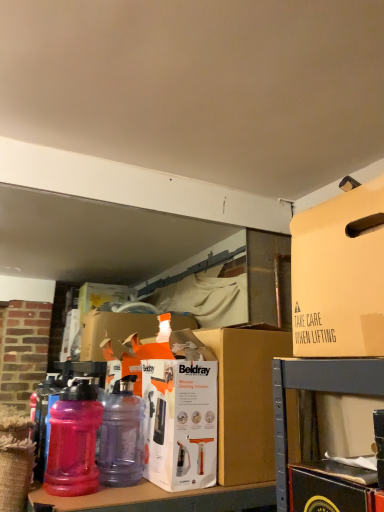
What do you see at coordinates (121, 436) in the screenshot? I see `translucent purple bottle at center, which ranks as the 2th bottle in left-to-right order` at bounding box center [121, 436].

Image resolution: width=384 pixels, height=512 pixels. In order to click on beige cardboard box at upper right in this screenshot , I will do (339, 275).

The width and height of the screenshot is (384, 512). What are the coordinates of `pink translucent water bottle at lower left, the 1th bottle in the left-to-right sequence` in the screenshot? It's located at (74, 440).

Considering the relative sizes of beige cardboard box at upper right and pink translucent water bottle at lower left, the 1th bottle in the left-to-right sequence, in the image provided, is beige cardboard box at upper right smaller than pink translucent water bottle at lower left, the 1th bottle in the left-to-right sequence,?

No, beige cardboard box at upper right is not smaller than pink translucent water bottle at lower left, the 1th bottle in the left-to-right sequence.

Is beige cardboard box at upper right beside pink translucent water bottle at lower left, the 2th bottle viewed from the right?

They are not placed beside each other.

Locate an element on the screen. The height and width of the screenshot is (512, 384). bottle that is in front of the translucent purple bottle at center, which ranks as the 2th bottle in left-to-right order is located at coordinates (74, 440).

Can pink translucent water bottle at lower left, the 2th bottle viewed from the right, be found inside translucent purple bottle at center, which ranks as the 2th bottle in left-to-right order?

No, pink translucent water bottle at lower left, the 2th bottle viewed from the right, is located outside of translucent purple bottle at center, which ranks as the 2th bottle in left-to-right order.

Would you say translucent purple bottle at center, which ranks as the 2th bottle in left-to-right order, is a long distance from pink translucent water bottle at lower left, the 2th bottle viewed from the right?

translucent purple bottle at center, which ranks as the 2th bottle in left-to-right order, is near pink translucent water bottle at lower left, the 2th bottle viewed from the right, not far away.

Is translucent purple bottle at center, which ranks as the 2th bottle in left-to-right order, at the right side of pink translucent water bottle at lower left, the 2th bottle viewed from the right?

Indeed, translucent purple bottle at center, which ranks as the 2th bottle in left-to-right order, is positioned on the right side of pink translucent water bottle at lower left, the 2th bottle viewed from the right.

From the image's perspective, is translucent purple bottle at center, which is counted as the 1th bottle, starting from the right, located beneath beige cardboard box at upper right?

Yes, from the image's perspective, translucent purple bottle at center, which is counted as the 1th bottle, starting from the right, is below beige cardboard box at upper right.

Is translucent purple bottle at center, which ranks as the 2th bottle in left-to-right order, to the right of beige cardboard box at upper right from the viewer's perspective?

In fact, translucent purple bottle at center, which ranks as the 2th bottle in left-to-right order, is to the left of beige cardboard box at upper right.

In the scene shown: Who is taller, translucent purple bottle at center, which is counted as the 1th bottle, starting from the right, or beige cardboard box at upper right?

translucent purple bottle at center, which is counted as the 1th bottle, starting from the right, is taller.

How much distance is there between translucent purple bottle at center, which ranks as the 2th bottle in left-to-right order, and brown cardboard box at center?

translucent purple bottle at center, which ranks as the 2th bottle in left-to-right order, is 31.29 centimeters away from brown cardboard box at center.

From a real-world perspective, is translucent purple bottle at center, which is counted as the 1th bottle, starting from the right, positioned under brown cardboard box at center based on gravity?

Correct, in the physical world, translucent purple bottle at center, which is counted as the 1th bottle, starting from the right, is lower than brown cardboard box at center.

Which is in front, point (114, 449) or point (226, 398)?

The point (114, 449) is in front.

Does translucent purple bottle at center, which ranks as the 2th bottle in left-to-right order, have a larger size compared to brown cardboard box at center?

→ Actually, translucent purple bottle at center, which ranks as the 2th bottle in left-to-right order, might be smaller than brown cardboard box at center.

Identify the location of bottle that is the 2nd object located below the brown cardboard box at center (from the image's perspective). (121, 436).

Does brown cardboard box at center turn towards translucent purple bottle at center, which ranks as the 2th bottle in left-to-right order?

No, brown cardboard box at center is not facing towards translucent purple bottle at center, which ranks as the 2th bottle in left-to-right order.

In the scene shown: What's the angular difference between brown cardboard box at center and translucent purple bottle at center, which ranks as the 2th bottle in left-to-right order,'s facing directions?

The facing directions of brown cardboard box at center and translucent purple bottle at center, which ranks as the 2th bottle in left-to-right order, are 0.601 degrees apart.

Measure the distance from brown cardboard box at center to translucent purple bottle at center, which ranks as the 2th bottle in left-to-right order.

brown cardboard box at center is 12.32 inches away from translucent purple bottle at center, which ranks as the 2th bottle in left-to-right order.

Does brown cardboard box at center lie behind beige cardboard box at upper right?

That is True.

Is point (264, 480) closer or farther from the camera than point (347, 233)?

Point (264, 480) is farther from the camera than point (347, 233).

Considering the relative sizes of brown cardboard box at center and beige cardboard box at upper right in the image provided, is brown cardboard box at center taller than beige cardboard box at upper right?

Yes.

From a real-world perspective, is brown cardboard box at center above or below beige cardboard box at upper right?

brown cardboard box at center is situated lower than beige cardboard box at upper right in the real world.

Is pink translucent water bottle at lower left, the 1th bottle in the left-to-right sequence, spatially inside translucent purple bottle at center, which is counted as the 1th bottle, starting from the right, or outside of it?

The correct answer is: outside.

From the image's perspective, would you say pink translucent water bottle at lower left, the 1th bottle in the left-to-right sequence, is shown under translucent purple bottle at center, which is counted as the 1th bottle, starting from the right?

Actually, pink translucent water bottle at lower left, the 1th bottle in the left-to-right sequence, appears above translucent purple bottle at center, which is counted as the 1th bottle, starting from the right, in the image.

Looking at this image, who is smaller, pink translucent water bottle at lower left, the 2th bottle viewed from the right, or translucent purple bottle at center, which ranks as the 2th bottle in left-to-right order?

translucent purple bottle at center, which ranks as the 2th bottle in left-to-right order, is smaller.

The image size is (384, 512). I want to click on bottle located underneath the pink translucent water bottle at lower left, the 2th bottle viewed from the right (from a real-world perspective), so click(121, 436).

Where is `bottle that is the 1st object located behind the beige cardboard box at upper right`? bottle that is the 1st object located behind the beige cardboard box at upper right is located at coordinates (74, 440).

I want to click on bottle directly beneath the pink translucent water bottle at lower left, the 1th bottle in the left-to-right sequence (from a real-world perspective), so click(x=121, y=436).

Based on their spatial positions, is translucent purple bottle at center, which is counted as the 1th bottle, starting from the right, or brown cardboard box at center further from pink translucent water bottle at lower left, the 2th bottle viewed from the right?

Among the two, brown cardboard box at center is located further to pink translucent water bottle at lower left, the 2th bottle viewed from the right.

When comparing their distances from pink translucent water bottle at lower left, the 1th bottle in the left-to-right sequence, does brown cardboard box at center or beige cardboard box at upper right seem closer?

brown cardboard box at center lies closer to pink translucent water bottle at lower left, the 1th bottle in the left-to-right sequence, than the other object.

Considering their positions, is beige cardboard box at upper right positioned further to pink translucent water bottle at lower left, the 1th bottle in the left-to-right sequence, than translucent purple bottle at center, which ranks as the 2th bottle in left-to-right order?

beige cardboard box at upper right is further to pink translucent water bottle at lower left, the 1th bottle in the left-to-right sequence.

Looking at this image, estimate the real-world distances between objects in this image. Which object is further from beige cardboard box at upper right, translucent purple bottle at center, which is counted as the 1th bottle, starting from the right, or pink translucent water bottle at lower left, the 1th bottle in the left-to-right sequence?

pink translucent water bottle at lower left, the 1th bottle in the left-to-right sequence, lies further to beige cardboard box at upper right than the other object.

Based on their spatial positions, is brown cardboard box at center or pink translucent water bottle at lower left, the 2th bottle viewed from the right, further from translucent purple bottle at center, which is counted as the 1th bottle, starting from the right?

Based on the image, brown cardboard box at center appears to be further to translucent purple bottle at center, which is counted as the 1th bottle, starting from the right.

When comparing their distances from translucent purple bottle at center, which is counted as the 1th bottle, starting from the right, does pink translucent water bottle at lower left, the 2th bottle viewed from the right, or brown cardboard box at center seem closer?

Based on the image, pink translucent water bottle at lower left, the 2th bottle viewed from the right, appears to be nearer to translucent purple bottle at center, which is counted as the 1th bottle, starting from the right.

Which object lies further to the anchor point pink translucent water bottle at lower left, the 2th bottle viewed from the right, brown cardboard box at center or translucent purple bottle at center, which ranks as the 2th bottle in left-to-right order?

The object further to pink translucent water bottle at lower left, the 2th bottle viewed from the right, is brown cardboard box at center.

Which object lies nearer to the anchor point beige cardboard box at upper right, brown cardboard box at center or translucent purple bottle at center, which ranks as the 2th bottle in left-to-right order?

Among the two, brown cardboard box at center is located nearer to beige cardboard box at upper right.

You are a GUI agent. You are given a task and a screenshot of the screen. Output one action in this format:
    pyautogui.click(x=<x>, y=<y>)
    Task: Click on the storage box between pink translucent water bottle at lower left, the 1th bottle in the left-to-right sequence, and beige cardboard box at upper right
    
    Given the screenshot: What is the action you would take?
    pyautogui.click(x=245, y=400)

Where is `bottle between pink translucent water bottle at lower left, the 2th bottle viewed from the right, and brown cardboard box at center`? The height and width of the screenshot is (512, 384). bottle between pink translucent water bottle at lower left, the 2th bottle viewed from the right, and brown cardboard box at center is located at coordinates (121, 436).

The width and height of the screenshot is (384, 512). I want to click on bottle located between pink translucent water bottle at lower left, the 1th bottle in the left-to-right sequence, and beige cardboard box at upper right in the left-right direction, so click(x=121, y=436).